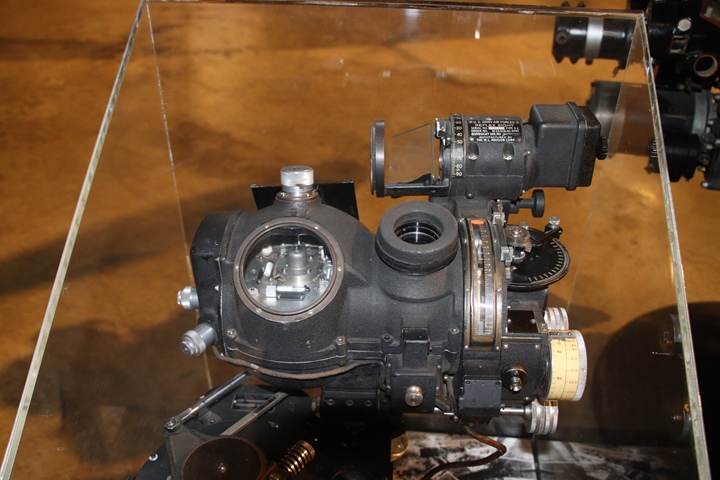
The width and height of the screenshot is (720, 480). I want to click on glass case, so click(207, 136).